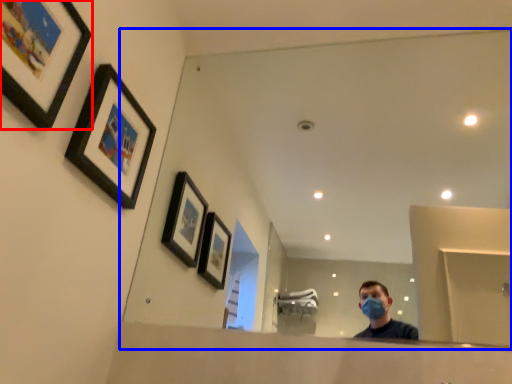
Question: Which of the following is the closest to the observer, picture frame (highlighted by a red box) or mirror (highlighted by a blue box)?

Choices:
 (A) picture frame
 (B) mirror

Answer: (A)